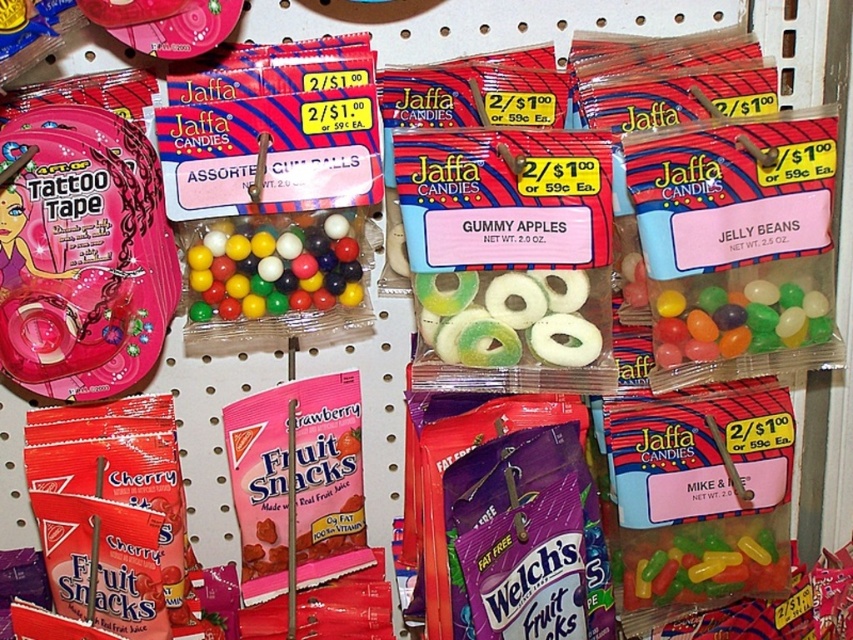
Does point (223, 307) come closer to viewer compared to point (660, 556)?

That is True.

Who is more forward, [337,291] or [723,525]?

Point [337,291]

Between point (198, 292) and point (669, 572), which one is positioned behind?

The point (669, 572) is more distant.

I want to click on glossy plastic gumballs at center, so point(273,266).

Does translucent jelly beans at right appear under translucent jelly beans at center?

Actually, translucent jelly beans at right is above translucent jelly beans at center.

Is translucent jelly beans at right taller than translucent jelly beans at center?

No, translucent jelly beans at right is not taller than translucent jelly beans at center.

Find the location of a particular element. translucent jelly beans at right is located at coordinates (735, 321).

At what (x,y) coordinates should I click in order to perform the action: click on translucent jelly beans at right. Please return your answer as a coordinate pair (x, y). Image resolution: width=853 pixels, height=640 pixels. Looking at the image, I should click on (735, 321).

This screenshot has height=640, width=853. Describe the element at coordinates (273, 266) in the screenshot. I see `glossy plastic gumballs at center` at that location.

Between glossy plastic gumballs at center and green translucent gummy rings at center, which one has less height?

With less height is green translucent gummy rings at center.

Measure the distance between point (201, 236) and camera.

→ They are 3.53 feet apart.

At what (x,y) coordinates should I click in order to perform the action: click on glossy plastic gumballs at center. Please return your answer as a coordinate pair (x, y). Image resolution: width=853 pixels, height=640 pixels. Looking at the image, I should click on (273, 266).